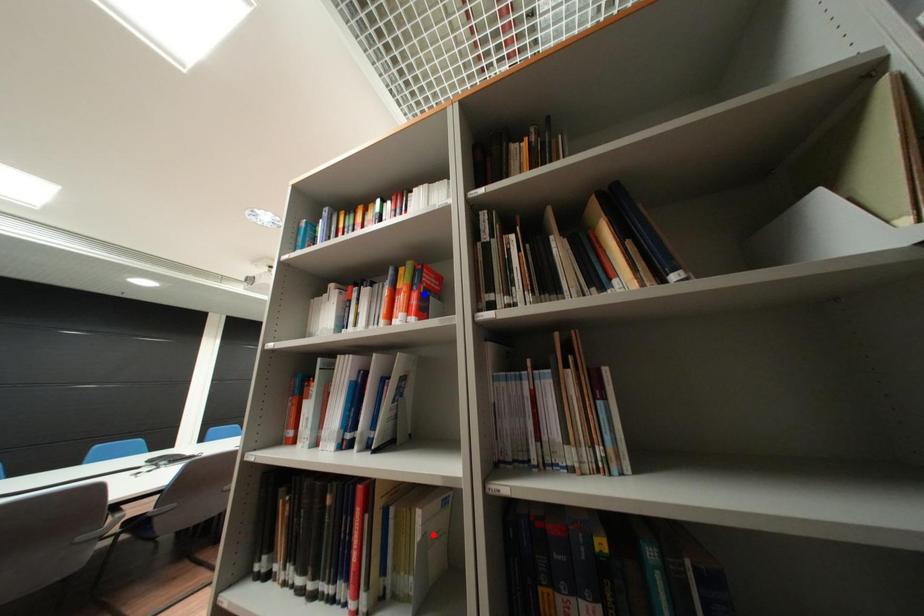
Question: Two points are marked on the image. Which point is closer to the camera?

Choices:
 (A) Blue point is closer.
 (B) Red point is closer.

Answer: (B)